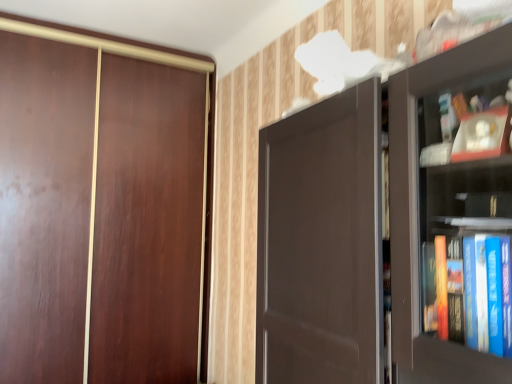
Identify the location of matte wood door at left. Image resolution: width=512 pixels, height=384 pixels. (100, 207).

What do you see at coordinates (100, 207) in the screenshot?
I see `matte wood door at left` at bounding box center [100, 207].

Locate an element on the screen. Image resolution: width=512 pixels, height=384 pixels. matte wood door at left is located at coordinates (100, 207).